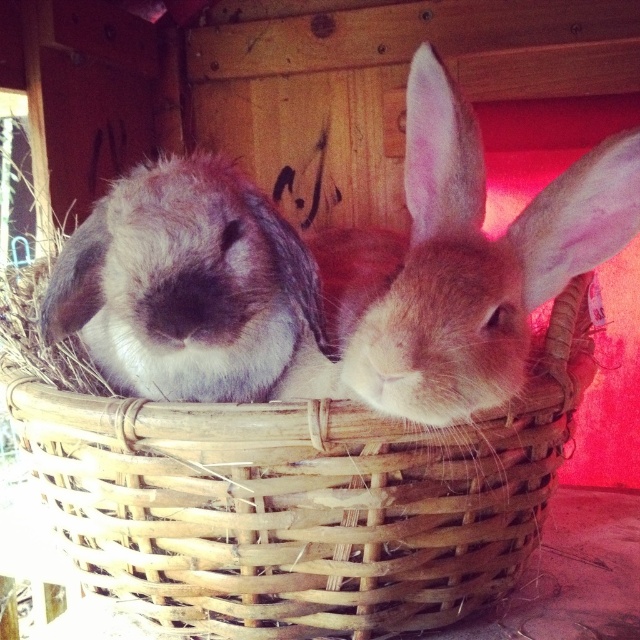
You have a small toy mouse that is 2 inches long. You want to place it between the woven wood basket at center and the brown fur rabbit at center. Is there enough space for the toy mouse to fit in between them?

The woven wood basket at center is 4.80 inches from the brown fur rabbit at center. Since the toy mouse is only 2 inches long, there is enough space between them to place the toy mouse.

You are standing in front of the basket with two rabbits. There is a point marked at coordinates (289, 490). According to the image description, what does this point represent?

The point at coordinates (289, 490) marks the woven wood basket at center.

You are trying to determine if the fuzzy brown rabbit at center can fit inside the woven wood basket at center. Based on the description, can it?

The woven wood basket at center is bigger than the fuzzy brown rabbit at center, so yes, the fuzzy brown rabbit at center can fit inside the woven wood basket at center.